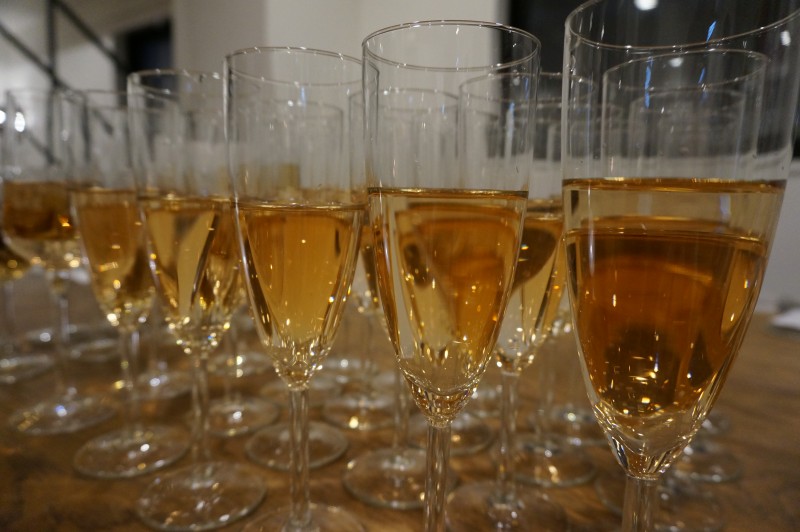
The width and height of the screenshot is (800, 532). In order to click on glass in this screenshot , I will do `click(16, 137)`, `click(80, 138)`, `click(154, 127)`, `click(258, 145)`, `click(412, 142)`, `click(541, 89)`, `click(642, 71)`, `click(625, 148)`, `click(430, 97)`.